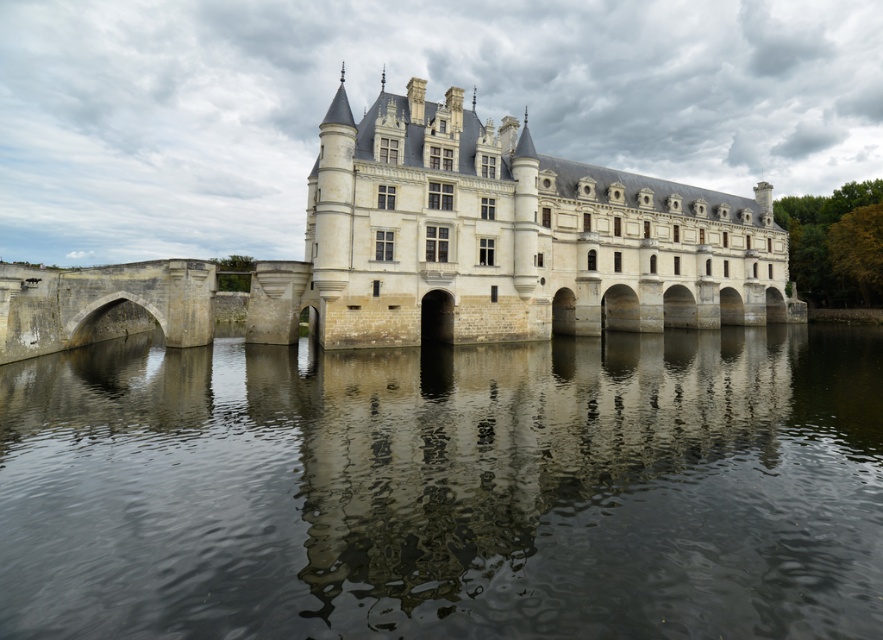
Question: Does dark reflective water at center have a greater width compared to stone castle at center?

Choices:
 (A) no
 (B) yes

Answer: (A)

Question: Can you confirm if dark reflective water at center is wider than stone castle at center?

Choices:
 (A) yes
 (B) no

Answer: (B)

Question: Which point is closer to the camera?

Choices:
 (A) stone castle at center
 (B) dark reflective water at center

Answer: (B)

Question: Does dark reflective water at center appear on the right side of stone castle at center?

Choices:
 (A) yes
 (B) no

Answer: (B)